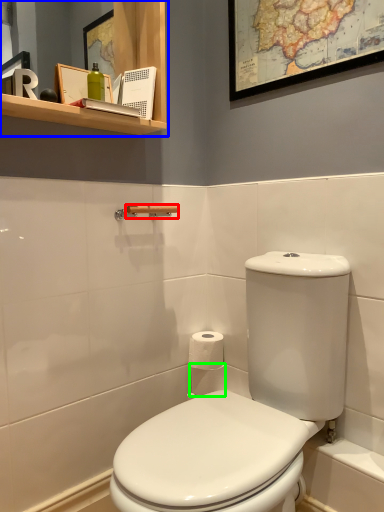
Question: Considering the real-world distances, which object is farthest from towel bar (highlighted by a red box)? bathroom cabinet (highlighted by a blue box) or toilet paper (highlighted by a green box)?

Choices:
 (A) bathroom cabinet
 (B) toilet paper

Answer: (B)